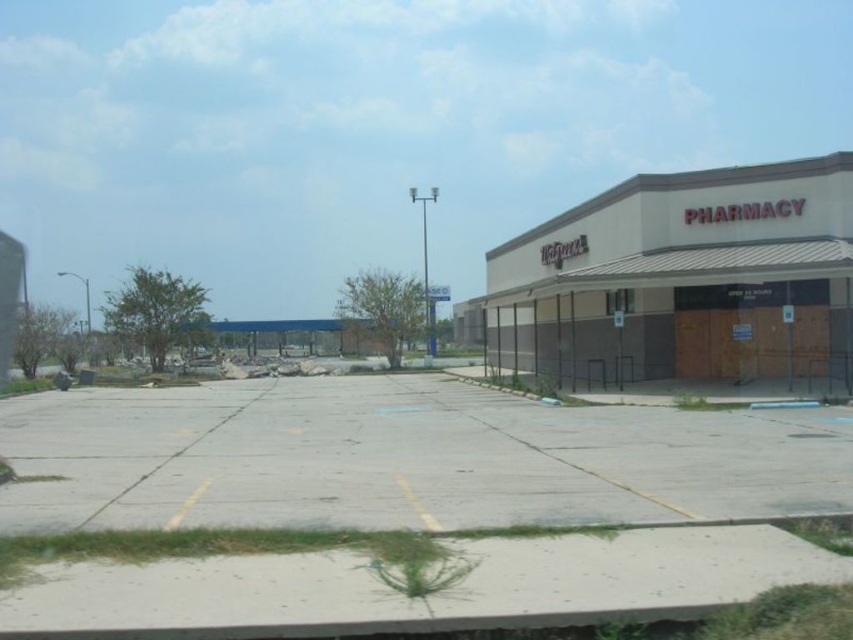
Does gray concrete parking lot at center have a smaller size compared to brown matte building at right?

Yes.

Which is above, gray concrete parking lot at center or brown matte building at right?

brown matte building at right is above.

Does point (817, 552) come in front of point (683, 316)?

Yes, point (817, 552) is in front of point (683, 316).

This screenshot has width=853, height=640. I want to click on gray concrete parking lot at center, so click(x=412, y=497).